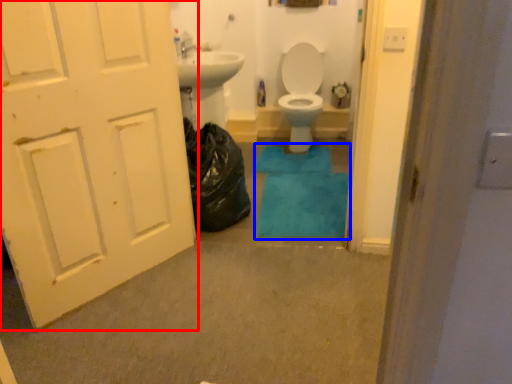
Question: Which object is further to the camera taking this photo, door (highlighted by a red box) or bath mat (highlighted by a blue box)?

Choices:
 (A) door
 (B) bath mat

Answer: (B)